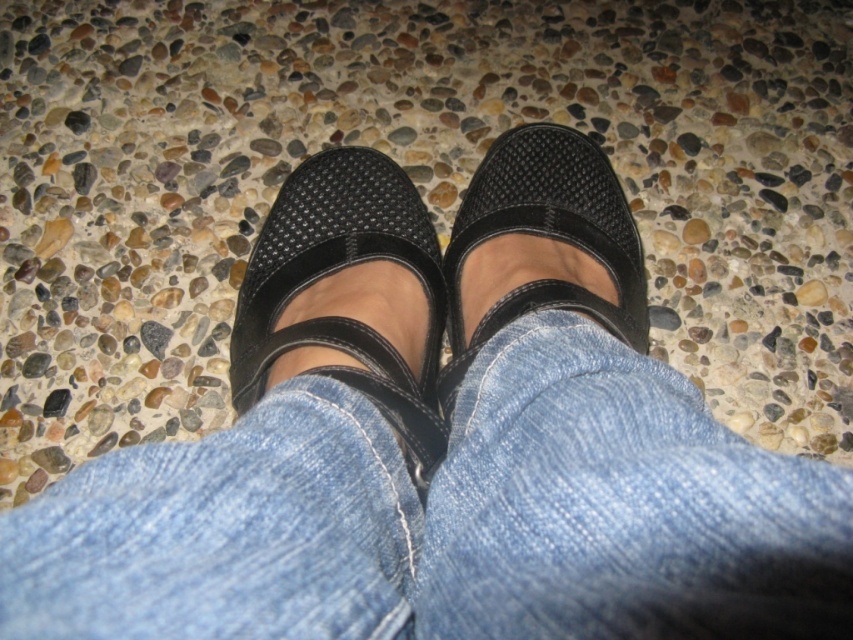
Question: Can you confirm if denim at center is positioned to the left of black mesh sandal at center?

Choices:
 (A) no
 (B) yes

Answer: (B)

Question: Is matte black mary jane shoes at center above black mesh sandal at center?

Choices:
 (A) no
 (B) yes

Answer: (A)

Question: Which point is closer to the camera taking this photo?

Choices:
 (A) (850, 595)
 (B) (321, 262)
 (C) (602, 202)

Answer: (A)

Question: Can you confirm if denim at center is bigger than black mesh sandal at center?

Choices:
 (A) no
 (B) yes

Answer: (A)

Question: Which point is farther from the camera taking this photo?

Choices:
 (A) (492, 186)
 (B) (538, 531)

Answer: (A)

Question: Estimate the real-world distances between objects in this image. Which object is closer to the black mesh sandal at center?

Choices:
 (A) matte black mary jane shoes at center
 (B) denim at center

Answer: (A)